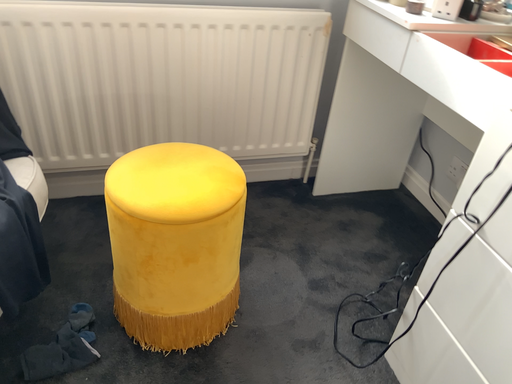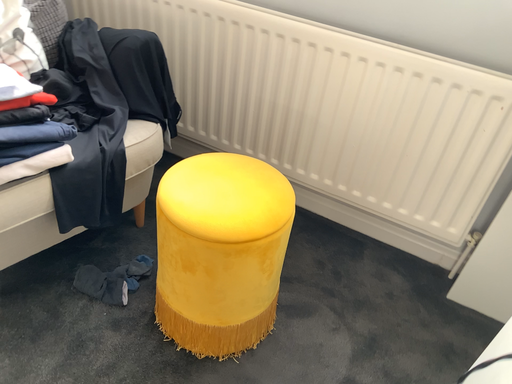
Question: Which way did the camera rotate in the video?

Choices:
 (A) rotated downward
 (B) rotated upward

Answer: (B)